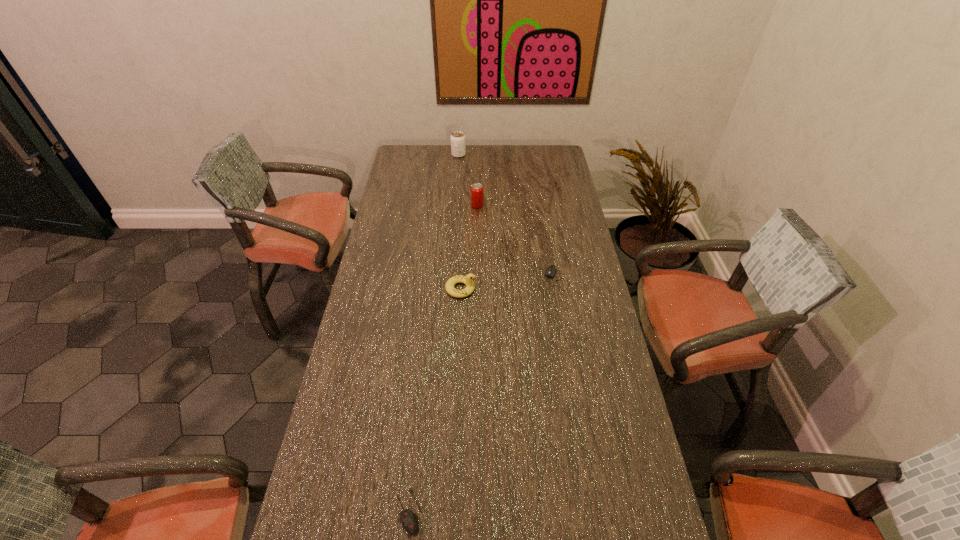
You are a GUI agent. You are given a task and a screenshot of the screen. Output one action in this format:
    pyautogui.click(x=<x>, y=<y>)
    Task: Click on the vacant space situated on the front of the right mouse
    Image resolution: width=960 pixels, height=540 pixels.
    Given the screenshot: What is the action you would take?
    [563, 310]

The image size is (960, 540). Find the location of `free space located on the right of the nearest object`. free space located on the right of the nearest object is located at coordinates (539, 510).

Where is `object positioned at the far edge`? The image size is (960, 540). object positioned at the far edge is located at coordinates (458, 146).

This screenshot has height=540, width=960. Identify the location of object that is at the right edge. (552, 269).

The height and width of the screenshot is (540, 960). I want to click on vacant space at the far edge of the desktop, so click(464, 157).

This screenshot has height=540, width=960. Identify the location of vacant area at the left edge. (409, 213).

This screenshot has width=960, height=540. Identify the location of free space at the right edge of the desktop. (547, 174).

Identify the location of vacant space at the far left corner. (409, 157).

You are a GUI agent. You are given a task and a screenshot of the screen. Output one action in this format:
    pyautogui.click(x=<x>, y=<y>)
    Task: Click on the free space that is in between the farther mouse and the left mouse
    This screenshot has width=960, height=540.
    Given the screenshot: What is the action you would take?
    pyautogui.click(x=483, y=394)

This screenshot has height=540, width=960. In order to click on free spot between the farthest object and the nearer mouse in this screenshot , I will do `click(434, 333)`.